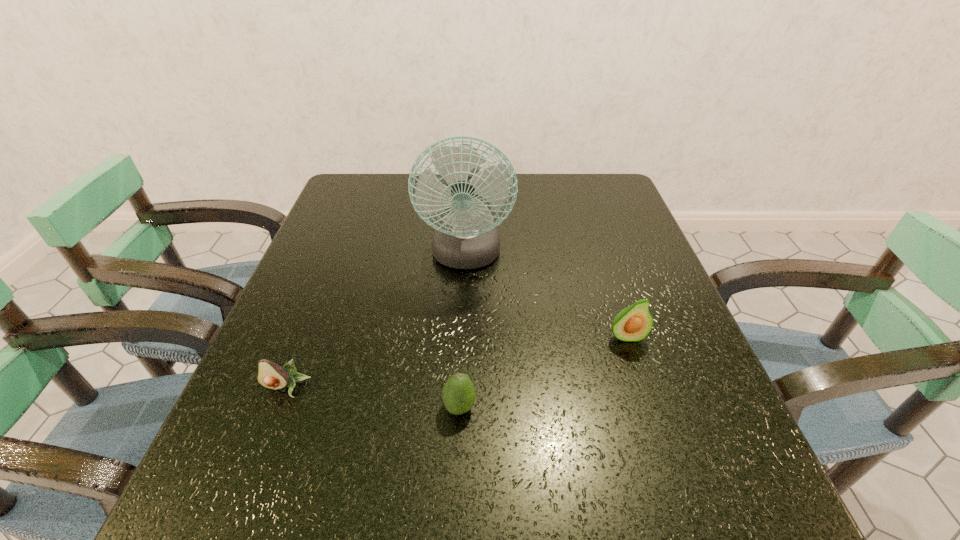
Locate an element on the screen. object that is at the left edge is located at coordinates (270, 375).

Where is `object that is at the right edge`? This screenshot has height=540, width=960. object that is at the right edge is located at coordinates (634, 323).

This screenshot has width=960, height=540. In order to click on vacant space at the far edge of the desktop in this screenshot , I will do [511, 200].

Where is `blank area at the near edge`? The height and width of the screenshot is (540, 960). blank area at the near edge is located at coordinates (522, 477).

You are a GUI agent. You are given a task and a screenshot of the screen. Output one action in this format:
    pyautogui.click(x=<x>, y=<y>)
    Task: Click on the vacant space at the left edge of the desktop
    
    Given the screenshot: What is the action you would take?
    pyautogui.click(x=344, y=257)

Where is `free space at the right edge`? This screenshot has height=540, width=960. free space at the right edge is located at coordinates (682, 409).

Where is `free space at the far left corner of the desktop`? This screenshot has width=960, height=540. free space at the far left corner of the desktop is located at coordinates (384, 173).

The height and width of the screenshot is (540, 960). What are the coordinates of `free region at the near left corner of the desktop` in the screenshot? It's located at (210, 534).

In the image, there is a desktop. Identify the location of vacant area at the far right corner. (631, 211).

Locate an element on the screen. free space between the leftmost object and the farthest object is located at coordinates (376, 322).